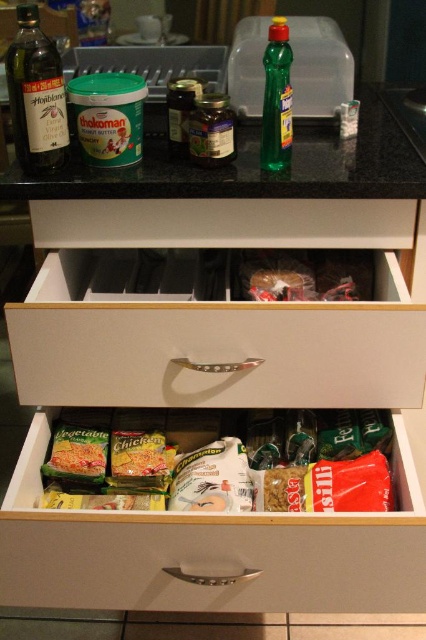
Question: Is wooden drawer at center to the left of matte glass bottle at left from the viewer's perspective?

Choices:
 (A) no
 (B) yes

Answer: (A)

Question: Which point is closer to the camera taking this photo?

Choices:
 (A) (54, 179)
 (B) (109, 490)

Answer: (A)

Question: Does matte plastic bag of pasta at center appear under green plastic bottle at center?

Choices:
 (A) yes
 (B) no

Answer: (A)

Question: Which point is closer to the camera?

Choices:
 (A) matte glass bottle at left
 (B) green plastic bottle at center
 (C) matte plastic bag of pasta at center
 (D) green glossy countertop at center

Answer: (A)

Question: Which object is positioned closest to the green plastic bottle at center?

Choices:
 (A) matte plastic bag of pasta at center
 (B) wooden drawer at center
 (C) matte glass bottle at left
 (D) green glossy countertop at center

Answer: (D)

Question: Does green glossy countertop at center have a larger size compared to green plastic bottle at center?

Choices:
 (A) yes
 (B) no

Answer: (A)